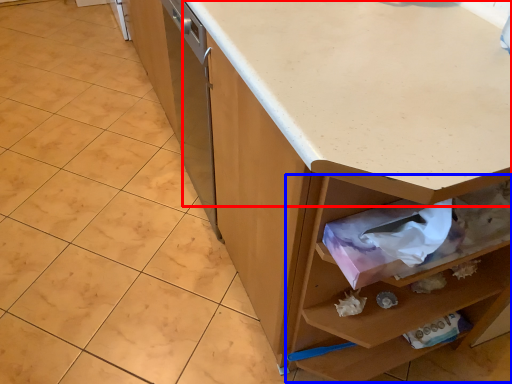
Question: Among these objects, which one is farthest to the camera, countertop (highlighted by a red box) or drawer (highlighted by a blue box)?

Choices:
 (A) countertop
 (B) drawer

Answer: (B)